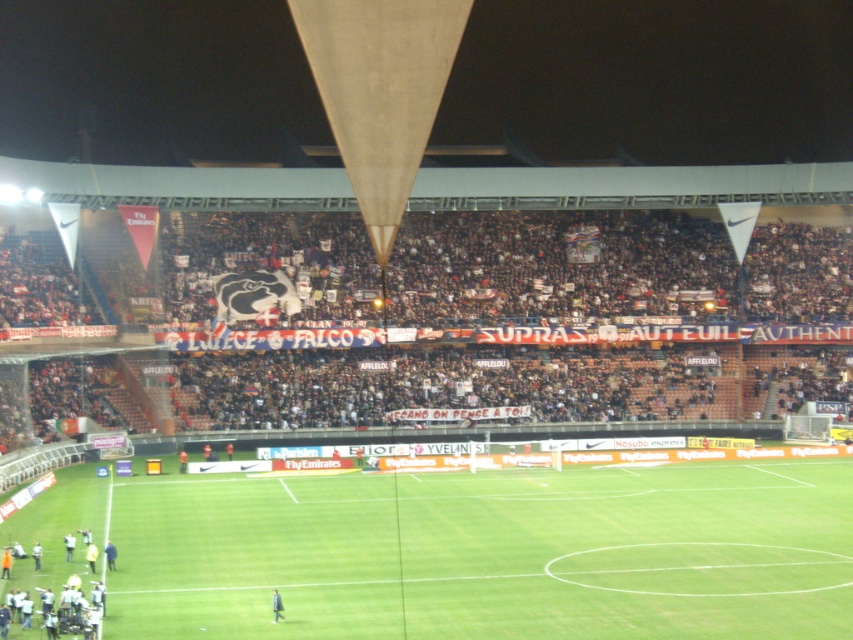
Question: Does dark blue jacket at center have a lesser width compared to dark blue uniform at center?

Choices:
 (A) yes
 (B) no

Answer: (A)

Question: Can you confirm if green grass football field at center is positioned to the left of dark blue uniform at center?

Choices:
 (A) yes
 (B) no

Answer: (B)

Question: Which point appears farthest from the camera in this image?

Choices:
 (A) (538, 557)
 (B) (273, 621)

Answer: (A)

Question: Which object is positioned farthest from the dark blue jacket at center?

Choices:
 (A) light yellow fabric at lower left
 (B) yellow fabric person at lower left
 (C) dark blue uniform at center
 (D) green grass football field at center

Answer: (D)

Question: Which point appears farthest from the camera in this image?

Choices:
 (A) (271, 602)
 (B) (33, 541)

Answer: (B)

Question: Can you confirm if green grass football field at center is wider than light yellow fabric at lower left?

Choices:
 (A) yes
 (B) no

Answer: (A)